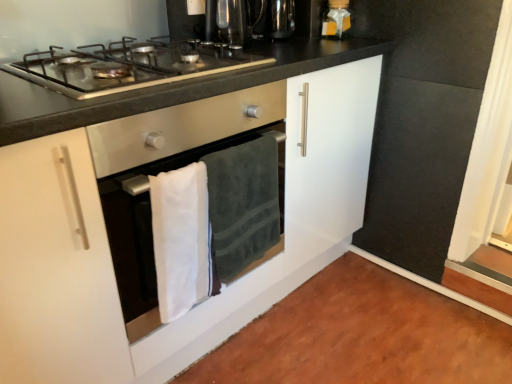
Find the location of a particular element. free spot in front of matte gold gift box at upper right is located at coordinates (338, 40).